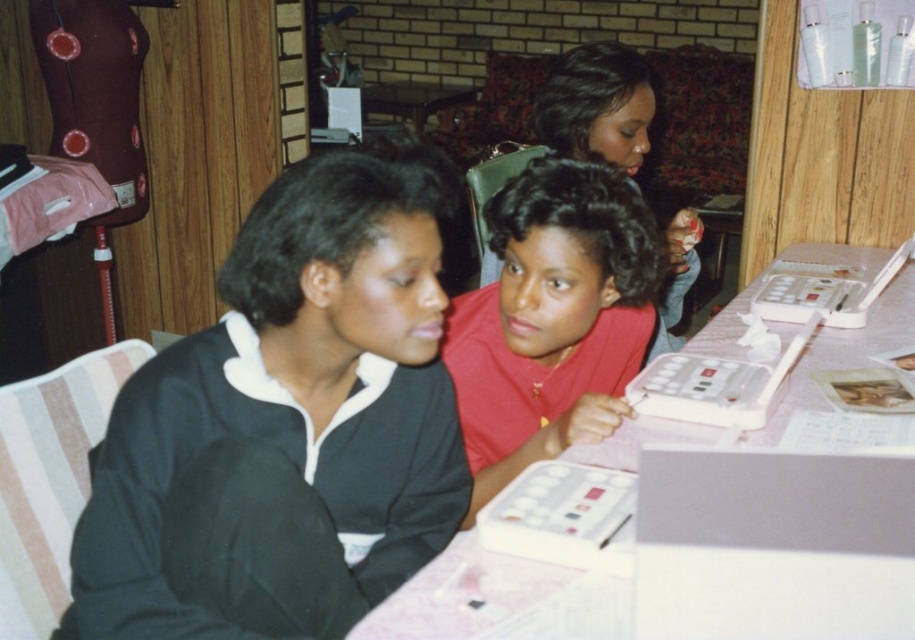
Question: From the image, what is the correct spatial relationship of pink plastic table at center in relation to matte pink shirt at center?

Choices:
 (A) right
 (B) left

Answer: (A)

Question: Does matte red shirt at center have a greater width compared to matte pink shirt at center?

Choices:
 (A) no
 (B) yes

Answer: (A)

Question: Among these objects, which one is nearest to the camera?

Choices:
 (A) black matte jacket at left
 (B) matte red shirt at center

Answer: (A)

Question: Which point is closer to the camera?

Choices:
 (A) matte pink shirt at center
 (B) pink plastic table at center

Answer: (B)

Question: Observing the image, what is the correct spatial positioning of black matte jacket at left in reference to matte pink shirt at center?

Choices:
 (A) below
 (B) above

Answer: (A)

Question: Estimate the real-world distances between objects in this image. Which object is farther from the black matte jacket at left?

Choices:
 (A) matte pink shirt at center
 (B) matte red shirt at center

Answer: (A)